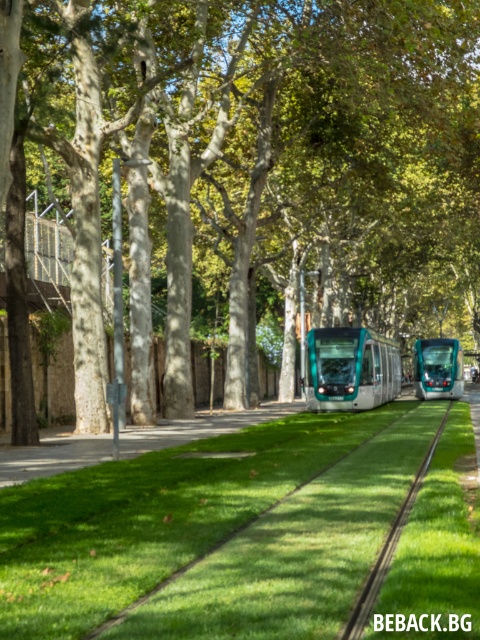
Question: Among these points, which one is farthest from the camera?

Choices:
 (A) (380, 556)
 (B) (418, 374)
 (C) (373, 362)
 (D) (182, 129)

Answer: (B)

Question: Observing the image, what is the correct spatial positioning of teal glass train at center in reference to teal glossy tram at center?

Choices:
 (A) below
 (B) above

Answer: (A)

Question: Can you confirm if green grass train track at center is positioned to the right of teal glossy tram at center?

Choices:
 (A) no
 (B) yes

Answer: (A)

Question: Which object appears closest to the camera in this image?

Choices:
 (A) green grass train track at center
 (B) teal glossy tram at center
 (C) teal glass train at center
 (D) green leafy tree at center

Answer: (A)

Question: Which point is closer to the camera?

Choices:
 (A) (407, 515)
 (B) (427, 369)
 (C) (264, 26)

Answer: (A)

Question: Considering the relative positions of green grass train track at center and teal glossy tram at center in the image provided, where is green grass train track at center located with respect to teal glossy tram at center?

Choices:
 (A) right
 (B) left

Answer: (B)